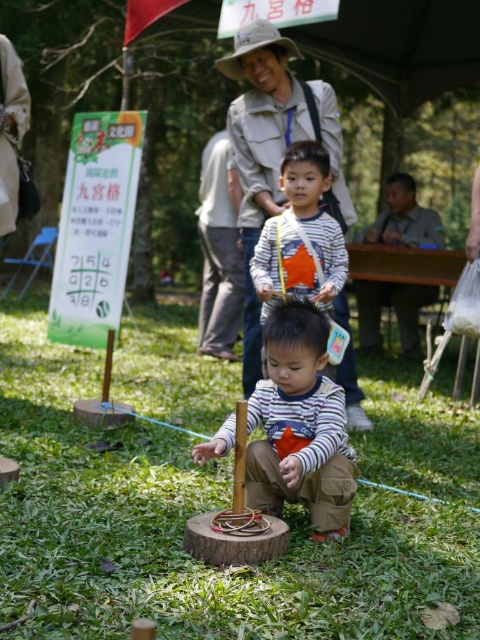
Question: Is striped cotton shirt at center further to the viewer compared to brown leather jacket at upper center?

Choices:
 (A) no
 (B) yes

Answer: (A)

Question: Which object is the farthest from the striped cotton shirt at center?

Choices:
 (A) striped cotton shirt at upper center
 (B) brown leather jacket at upper center

Answer: (B)

Question: Is brown leather jacket at upper center positioned before brown leather jacket at right?

Choices:
 (A) no
 (B) yes

Answer: (B)

Question: Which object appears farthest from the camera in this image?

Choices:
 (A) brown leather jacket at upper center
 (B) brown leather jacket at right
 (C) striped cotton shirt at upper center
 (D) striped cotton shirt at center

Answer: (B)

Question: Which point is closer to the camera?

Choices:
 (A) (298, 189)
 (B) (399, 228)

Answer: (A)

Question: Is striped cotton shirt at upper center closer to the viewer compared to brown leather jacket at right?

Choices:
 (A) no
 (B) yes

Answer: (B)